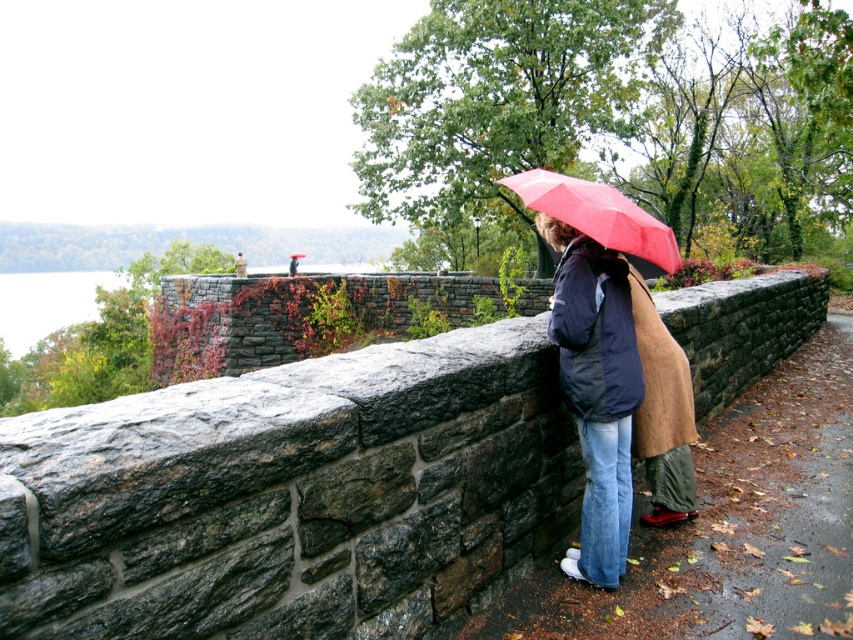
Image resolution: width=853 pixels, height=640 pixels. Describe the element at coordinates (292, 493) in the screenshot. I see `stone wall at center` at that location.

Who is shorter, stone wall at center or matte black jacket at center?

Standing shorter between the two is stone wall at center.

Which is behind, point (294, 589) or point (555, 243)?

Point (555, 243)

The image size is (853, 640). Find the location of `stone wall at center`. stone wall at center is located at coordinates (292, 493).

Measure the distance between point (274,496) and camera.

They are 2.14 meters apart.

Between point (94, 522) and point (560, 173), which one is positioned in front?

Positioned in front is point (94, 522).

Where is `stone wall at center`? stone wall at center is located at coordinates (292, 493).

Which is behind, point (659, 500) or point (630, 244)?

The point (659, 500) is more distant.

Measure the distance between matte black jacket at center and matte red umbrella at upper center.

matte black jacket at center and matte red umbrella at upper center are 25.51 inches apart.

This screenshot has height=640, width=853. Describe the element at coordinates (618, 396) in the screenshot. I see `matte black jacket at center` at that location.

Where is `matte black jacket at center`? matte black jacket at center is located at coordinates (618, 396).